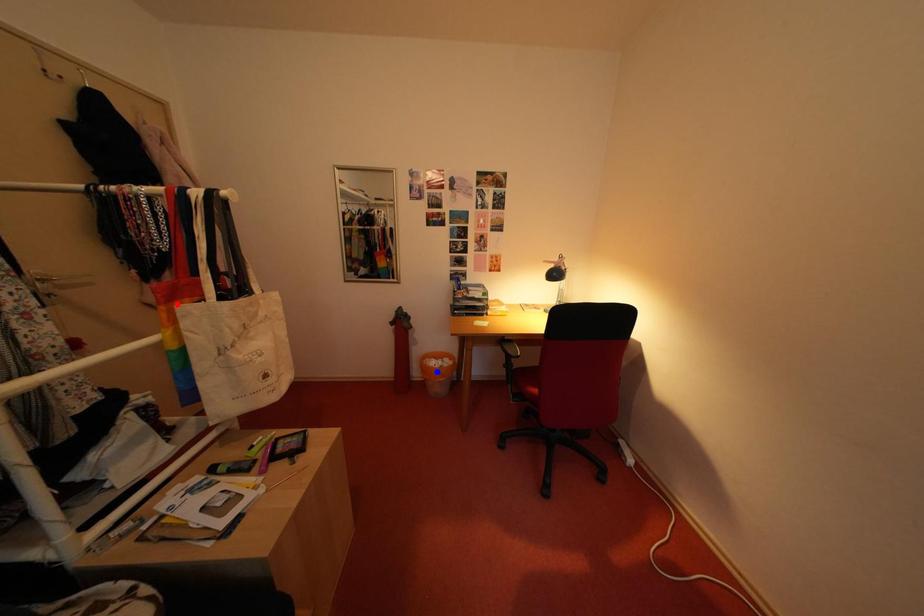
Question: In the image, two points are highlighted. Which point is nearer to the camera? Reply with the corresponding letter.

Choices:
 (A) blue point
 (B) red point

Answer: (B)